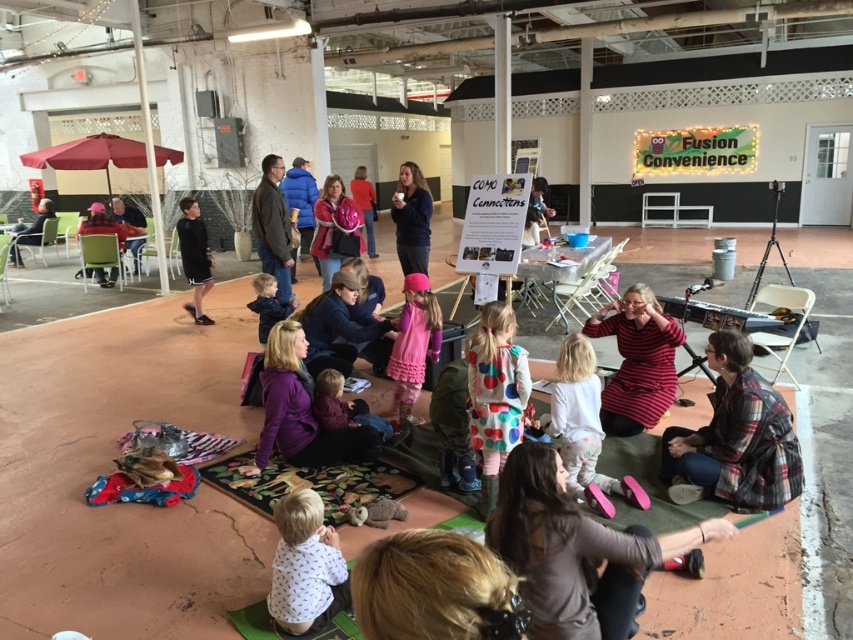
You are a guest at this event and want to find the dark brown leather jacket at lower center. Which direction should you look relative to the matte pink jacket at center?

The dark brown leather jacket at lower center is located below the matte pink jacket at center, so you should look downward from the matte pink jacket at center to find it.

You are a photographer standing at the back of the room. You want to take a photo that includes both the dark brown leather jacket at lower center and the striped fabric dress at center. The camera you are using has a maximum focus range of 6 feet. Can you capture both objects in the same frame without moving closer?

The distance between the dark brown leather jacket at lower center and the striped fabric dress at center is 6.66 feet. Since the camera can only focus up to 6 feet, the objects are slightly too far apart to be captured in the same frame without moving closer.